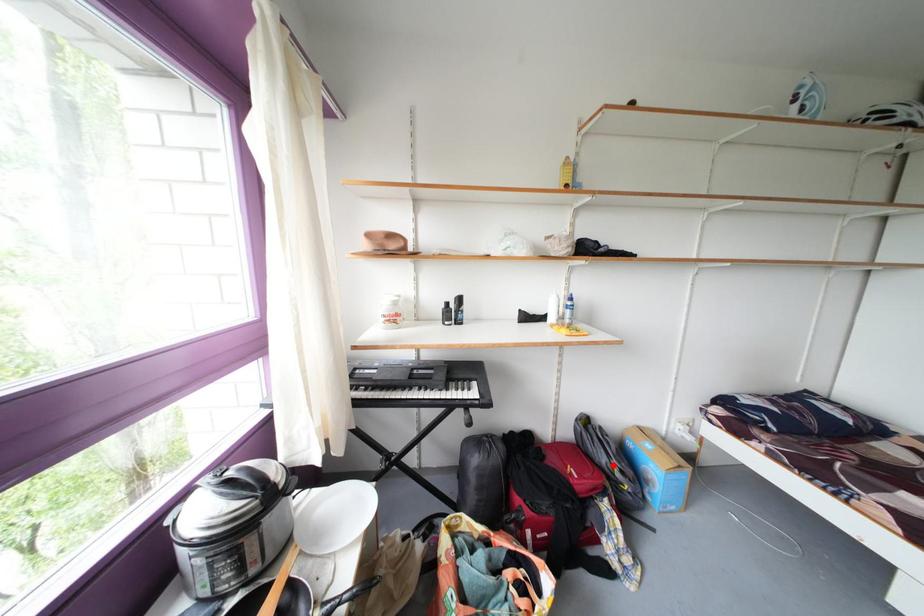
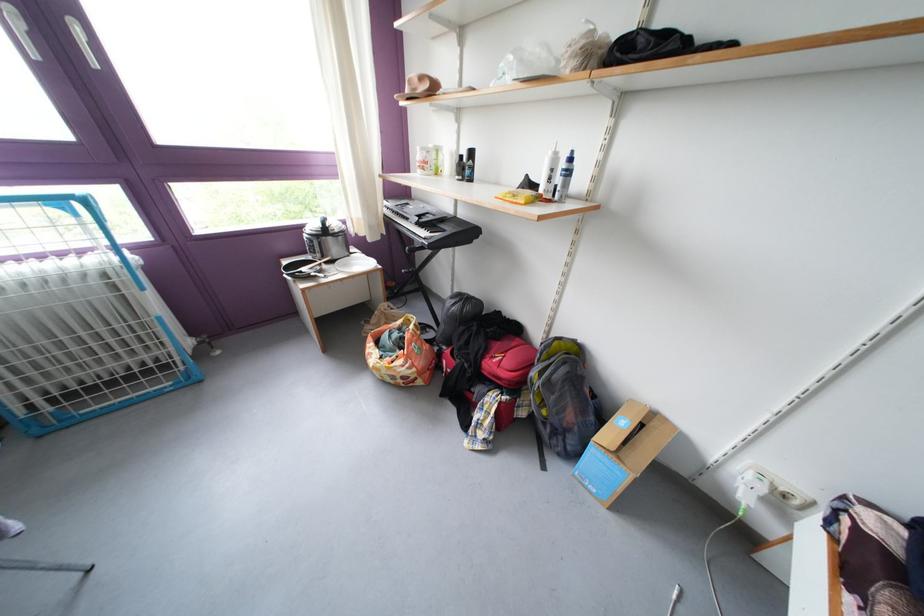
In the second image, find the point that corresponds to the highlighted location in the first image.

(543, 379)